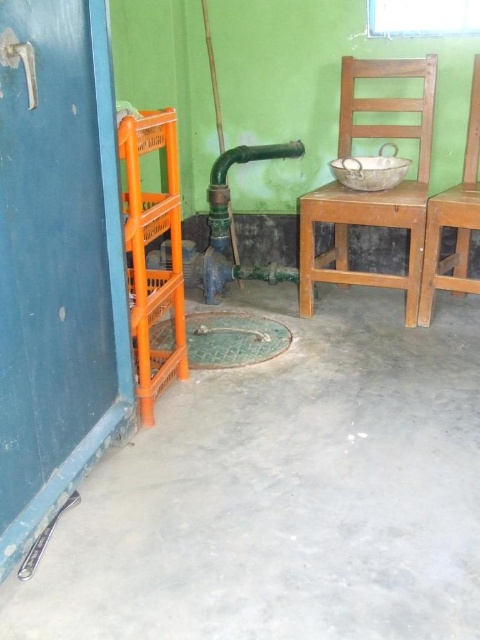
In the scene shown: Can you confirm if wooden chair at center is positioned above wooden chair at right?

Yes.

Does wooden chair at center have a smaller size compared to wooden chair at right?

Actually, wooden chair at center might be larger than wooden chair at right.

Which is behind, point (375, 195) or point (450, 259)?

Positioned behind is point (450, 259).

This screenshot has height=640, width=480. Find the location of `wooden chair at center`. wooden chair at center is located at coordinates (374, 193).